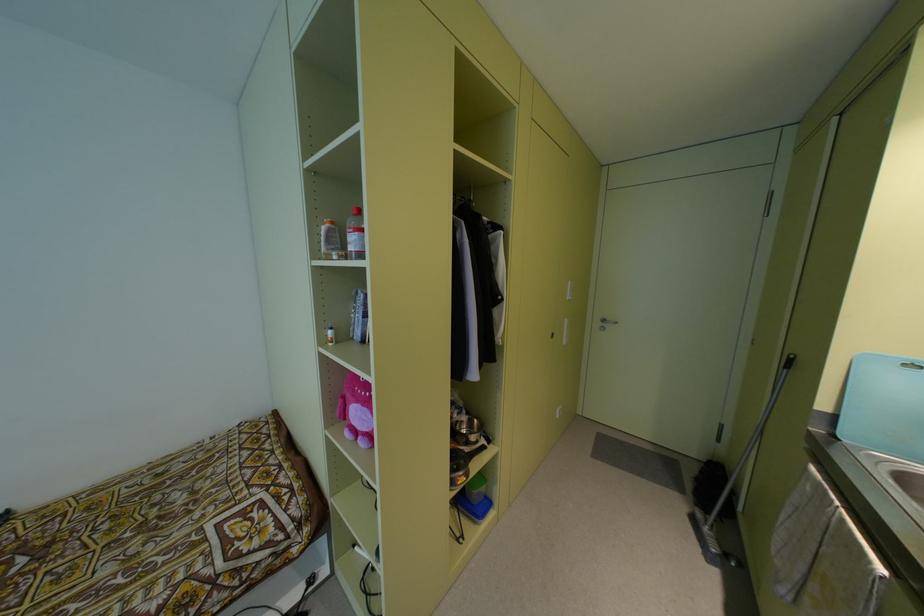
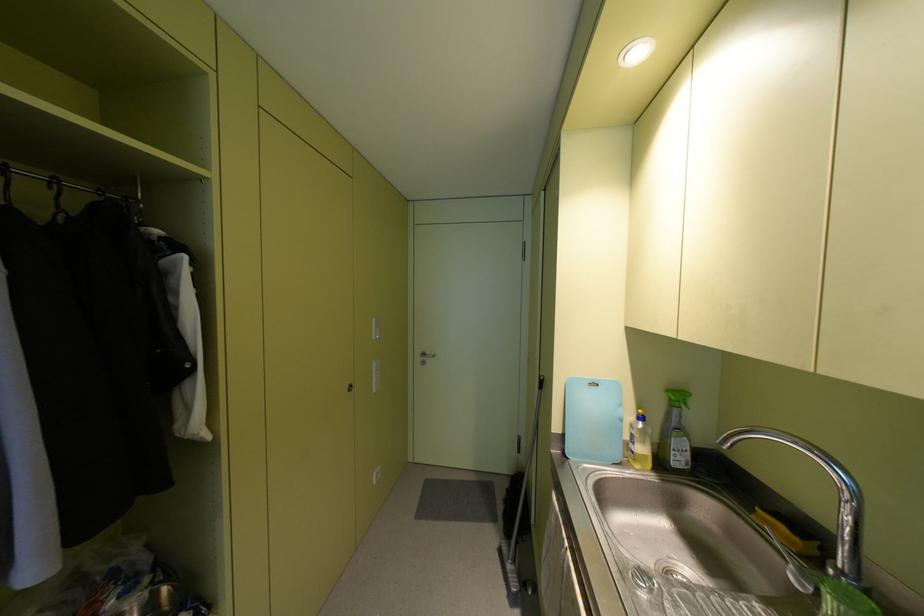
Where in the second image is the point corresponding to [602,320] from the first image?

(422, 354)